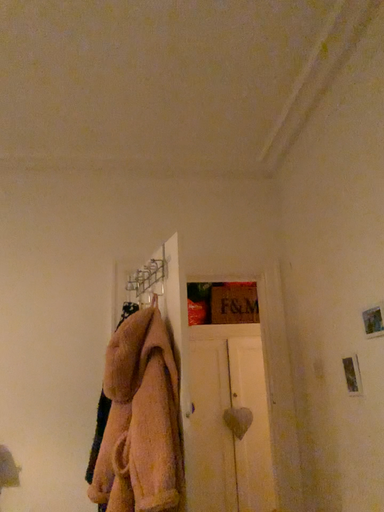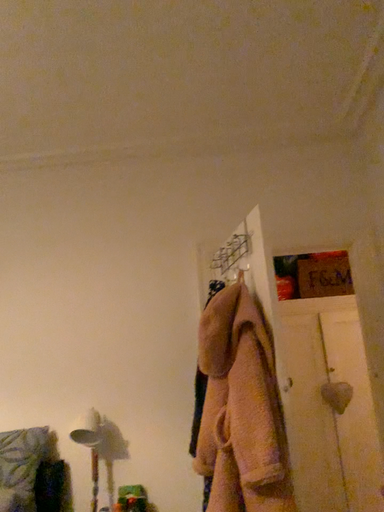
Question: Which way did the camera rotate in the video?

Choices:
 (A) rotated right
 (B) rotated left

Answer: (B)